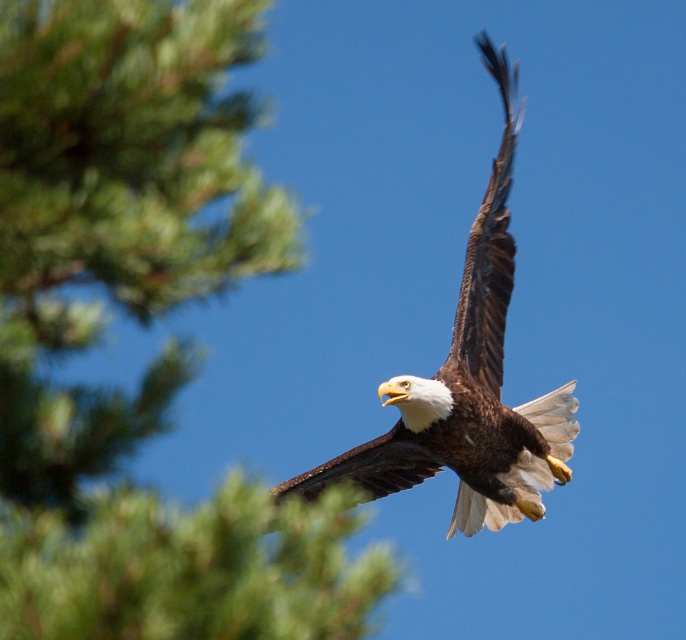
Does green textured pine tree at upper left appear on the left side of brown feathered eagle at center?

Correct, you'll find green textured pine tree at upper left to the left of brown feathered eagle at center.

Who is more distant from viewer, (10, 168) or (414, 392)?

Positioned behind is point (414, 392).

Which is in front, point (1, 515) or point (425, 397)?

Point (1, 515) is more forward.

This screenshot has width=686, height=640. I want to click on green textured pine tree at upper left, so click(141, 323).